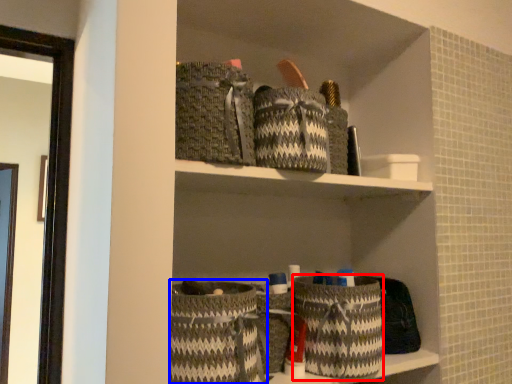
Question: Which of the following is the closest to the observer, basket (highlighted by a red box) or basket (highlighted by a blue box)?

Choices:
 (A) basket
 (B) basket

Answer: (B)